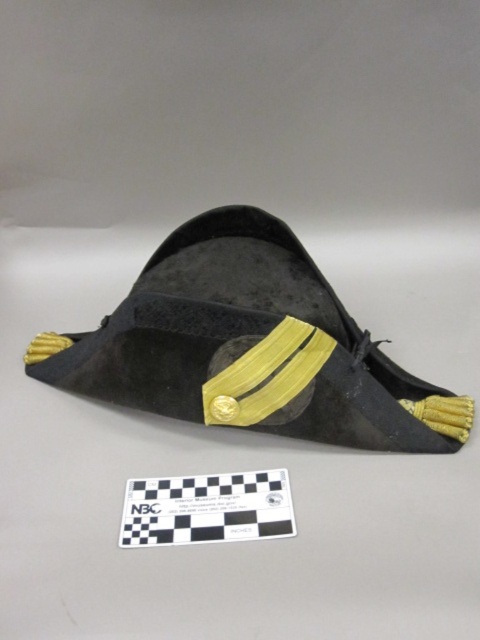
Question: Can you confirm if velvet black tricorn hat at center is positioned below black paper at center?

Choices:
 (A) no
 (B) yes

Answer: (A)

Question: Does velvet black tricorn hat at center have a lesser width compared to black paper at center?

Choices:
 (A) yes
 (B) no

Answer: (B)

Question: Is velvet black tricorn hat at center smaller than black paper at center?

Choices:
 (A) yes
 (B) no

Answer: (B)

Question: Which point is closer to the camera?

Choices:
 (A) (303, 372)
 (B) (122, 516)

Answer: (B)

Question: Among these points, which one is nearest to the camera?

Choices:
 (A) (397, 444)
 (B) (236, 481)

Answer: (B)